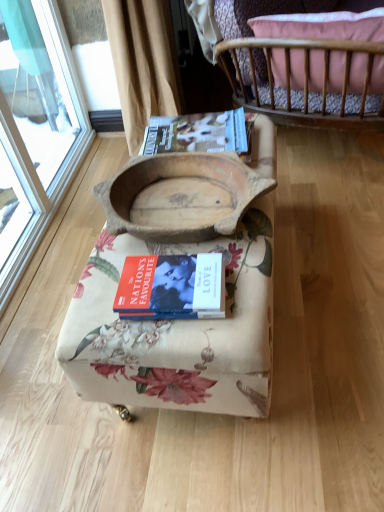
Identify the location of vacant space in wooden bowl at center (from a real-world perspective). The image size is (384, 512). (182, 203).